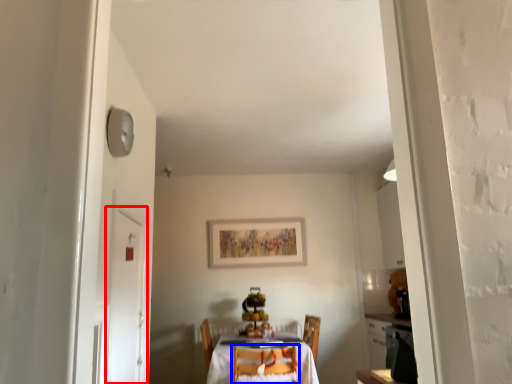
Question: Which object is further to the camera taking this photo, door (highlighted by a red box) or chair (highlighted by a blue box)?

Choices:
 (A) door
 (B) chair

Answer: (B)